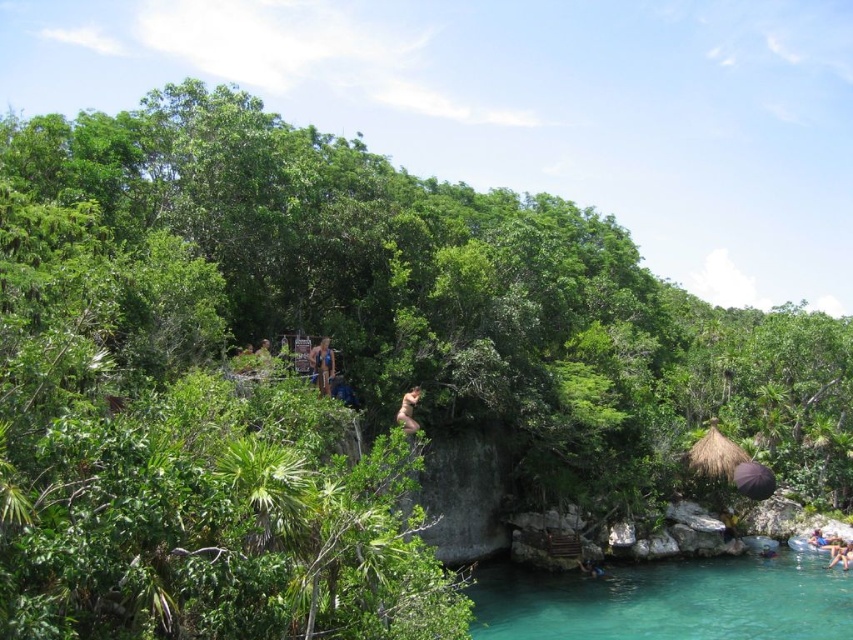
Question: Which of the following is the farthest from the observer?

Choices:
 (A) (848, 561)
 (B) (410, 426)
 (C) (750, 596)
 (D) (819, 536)

Answer: (D)

Question: Which point is closer to the camera?

Choices:
 (A) teal glassy water at lower center
 (B) brown leather backpack at lower right
 (C) tan skin person at center
 (D) pink fabric person at lower right

Answer: (A)

Question: Is tan skin person at center further to camera compared to brown leather backpack at lower right?

Choices:
 (A) yes
 (B) no

Answer: (A)

Question: Is teal glassy water at lower center to the right of matte blue swimsuit at center from the viewer's perspective?

Choices:
 (A) yes
 (B) no

Answer: (A)

Question: Estimate the real-world distances between objects in this image. Which object is farther from the teal glassy water at lower center?

Choices:
 (A) matte blue swimsuit at center
 (B) tan skin person at center

Answer: (A)

Question: Can you confirm if teal glassy water at lower center is positioned to the left of brown leather backpack at lower right?

Choices:
 (A) no
 (B) yes

Answer: (A)